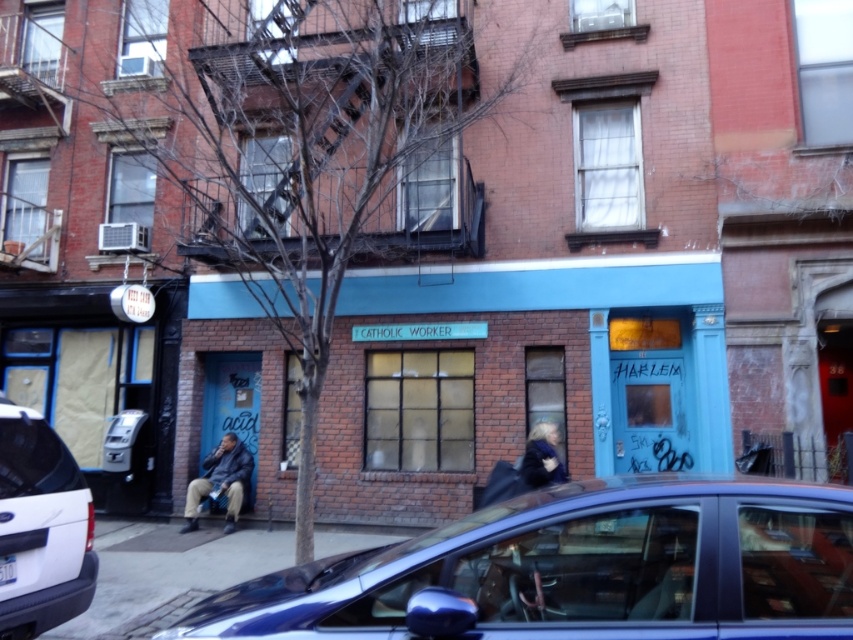
Question: In this image, where is metallic blue sedan at lower center located relative to white matte suv at lower left?

Choices:
 (A) below
 (B) above

Answer: (B)

Question: Which object is farther from the camera taking this photo?

Choices:
 (A) white matte suv at lower left
 (B) dark blue jacket at center
 (C) metallic blue sedan at lower center

Answer: (B)

Question: Which of the following is the farthest from the observer?

Choices:
 (A) (430, 593)
 (B) (82, 608)
 (C) (251, 529)

Answer: (C)

Question: Is blue brick building at center above dark blue jacket at lower left?

Choices:
 (A) no
 (B) yes

Answer: (B)

Question: Among these objects, which one is farthest from the camera?

Choices:
 (A) dark blue jacket at center
 (B) dark blue jacket at lower left

Answer: (B)

Question: Does metallic blue sedan at lower center appear on the left side of dark blue jacket at center?

Choices:
 (A) no
 (B) yes

Answer: (B)